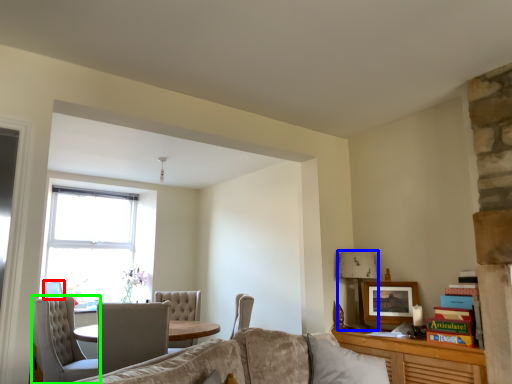
Question: Which object is the farthest from picture frame (highlighted by a red box)? Choose among these: lamp (highlighted by a blue box) or chair (highlighted by a green box).

Choices:
 (A) lamp
 (B) chair

Answer: (A)